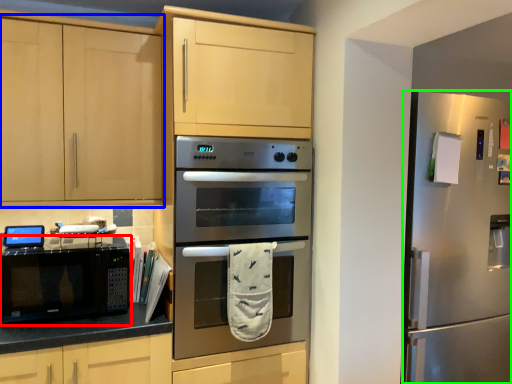
Question: Which object is the closest to the microwave oven (highlighted by a red box)? Choose among these: cabinetry (highlighted by a blue box) or refrigerator (highlighted by a green box).

Choices:
 (A) cabinetry
 (B) refrigerator

Answer: (A)